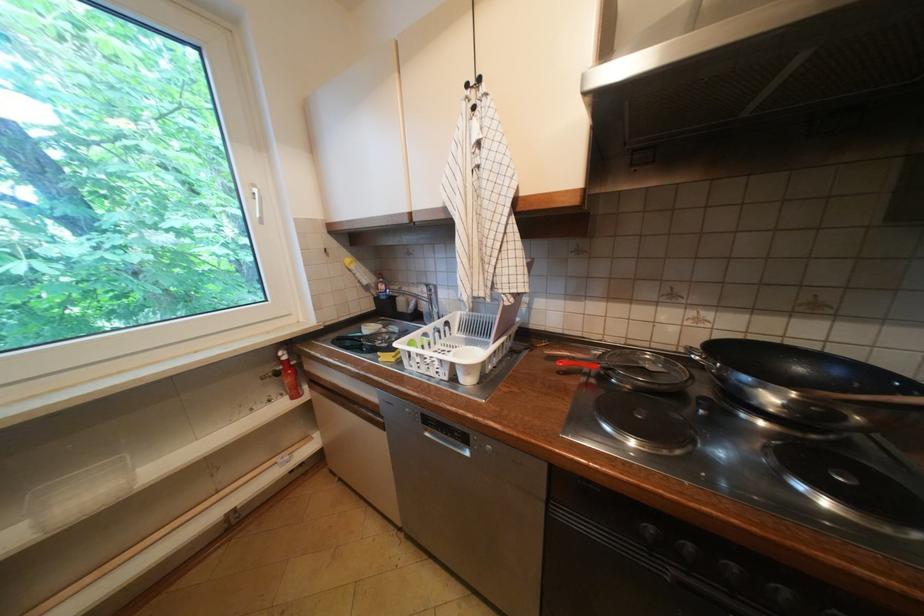
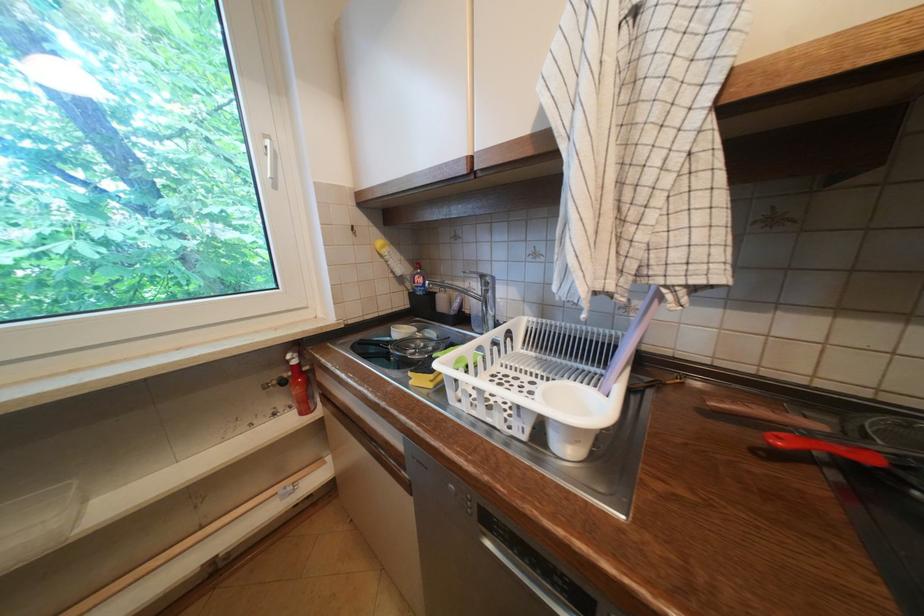
Locate, in the second image, the point that corresponds to (361,273) in the first image.

(394, 259)